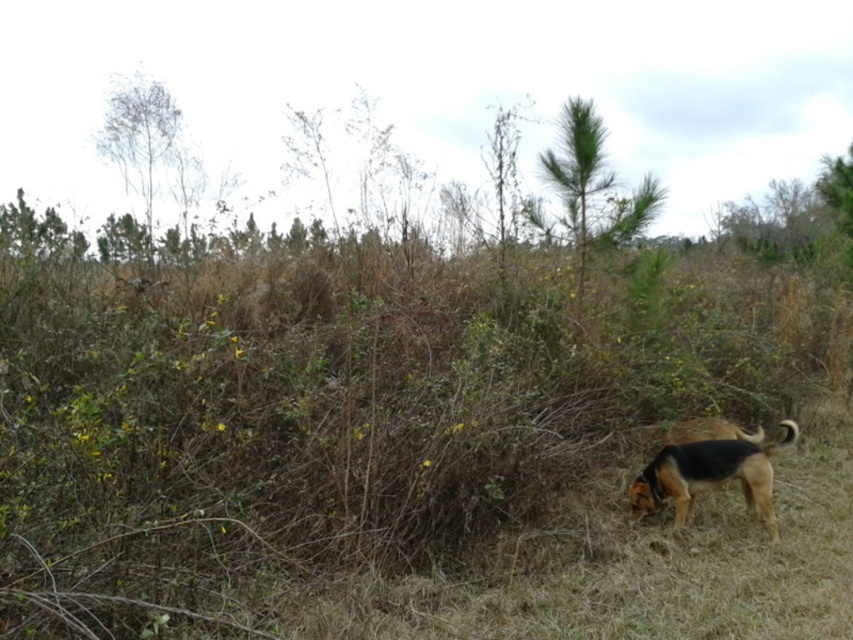
Question: Is bare branches at upper left smaller than brown fur dog at lower right?

Choices:
 (A) yes
 (B) no

Answer: (B)

Question: Is bare branches at upper left bigger than brown fur dog at lower right?

Choices:
 (A) no
 (B) yes

Answer: (B)

Question: Considering the relative positions of bare branches at upper left and brown fur dog at lower right in the image provided, where is bare branches at upper left located with respect to brown fur dog at lower right?

Choices:
 (A) above
 (B) below

Answer: (A)

Question: Which point is farther from the camera taking this photo?

Choices:
 (A) (645, 499)
 (B) (154, 186)

Answer: (B)